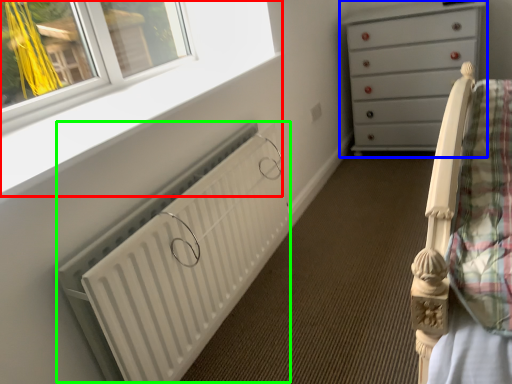
Question: Which object is positioned closest to window frame (highlighted by a red box)? Select from chest of drawers (highlighted by a blue box) and radiator (highlighted by a green box).

Choices:
 (A) chest of drawers
 (B) radiator

Answer: (B)